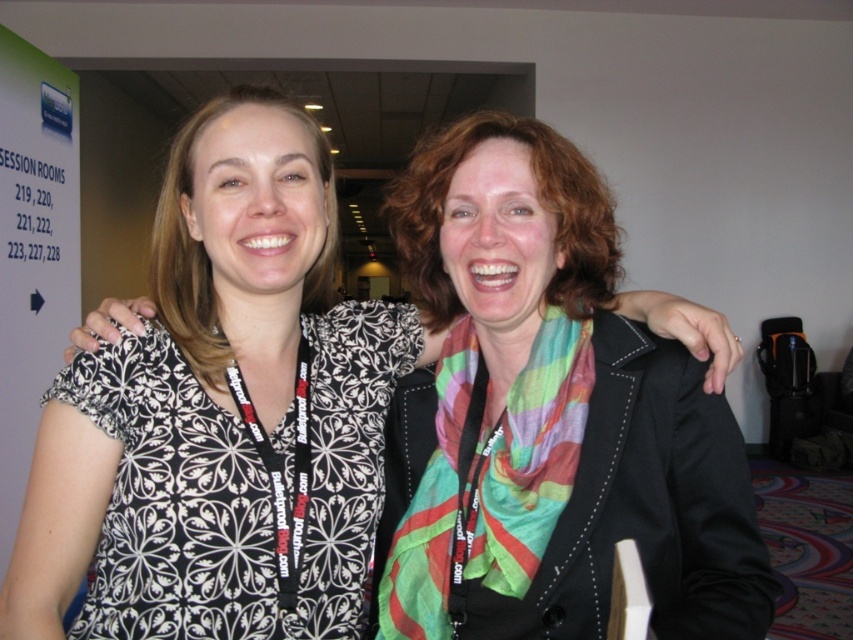
Does patterned fabric blouse at center appear over black printed fabric dress at left?

Yes, patterned fabric blouse at center is above black printed fabric dress at left.

Who is lower down, patterned fabric blouse at center or black printed fabric dress at left?

black printed fabric dress at left is below.

Is point (323, 193) closer to camera compared to point (207, 403)?

No, (323, 193) is behind (207, 403).

The image size is (853, 640). In order to click on patterned fabric blouse at center in this screenshot , I will do `click(270, 346)`.

Which is in front, point (227, 490) or point (457, 413)?

Point (227, 490)

Does black printed fabric dress at left appear under multicolored silk scarf at center?

No.

Locate an element on the screen. Image resolution: width=853 pixels, height=640 pixels. black printed fabric dress at left is located at coordinates (236, 486).

Can you confirm if patterned fabric blouse at center is positioned to the left of multicolored silk scarf at center?

Yes, patterned fabric blouse at center is to the left of multicolored silk scarf at center.

Identify the location of patterned fabric blouse at center. (270, 346).